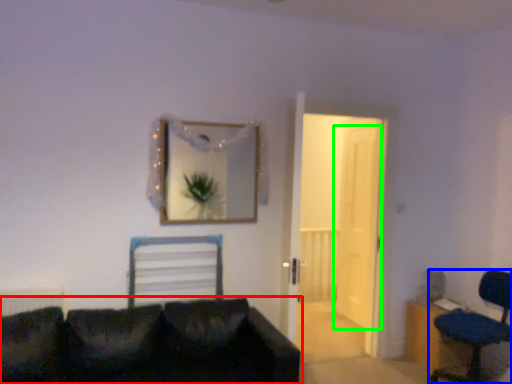
Question: Which object is the closest to the studio couch (highlighted by a red box)? Choose among these: chair (highlighted by a blue box) or door (highlighted by a green box).

Choices:
 (A) chair
 (B) door

Answer: (A)